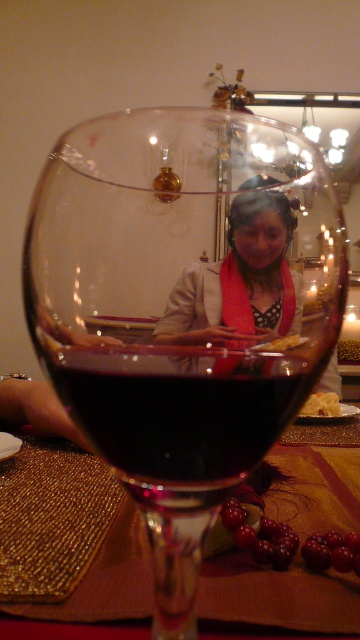
Question: Which object appears closest to the camera in this image?

Choices:
 (A) shiny gold placemat at center
 (B) shiny dark red wine at center

Answer: (B)

Question: Does shiny dark red wine at center have a larger size compared to shiny gold placemat at center?

Choices:
 (A) yes
 (B) no

Answer: (B)

Question: Is shiny dark red wine at center closer to camera compared to shiny gold placemat at center?

Choices:
 (A) yes
 (B) no

Answer: (A)

Question: In this image, where is shiny dark red wine at center located relative to shiny gold placemat at center?

Choices:
 (A) below
 (B) above

Answer: (B)

Question: Which object appears farthest from the camera in this image?

Choices:
 (A) shiny dark red wine at center
 (B) shiny gold placemat at center

Answer: (B)